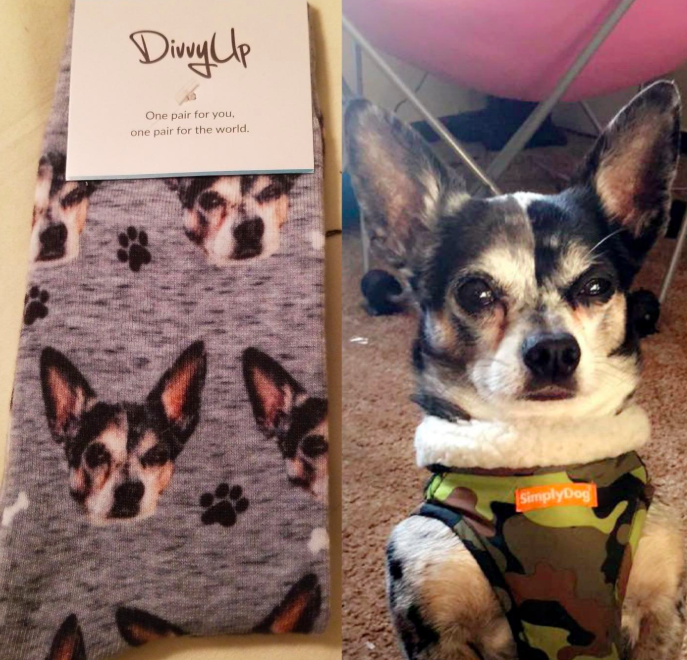
Image resolution: width=687 pixels, height=660 pixels. Find the location of `brown carpet`. brown carpet is located at coordinates pyautogui.click(x=361, y=525).